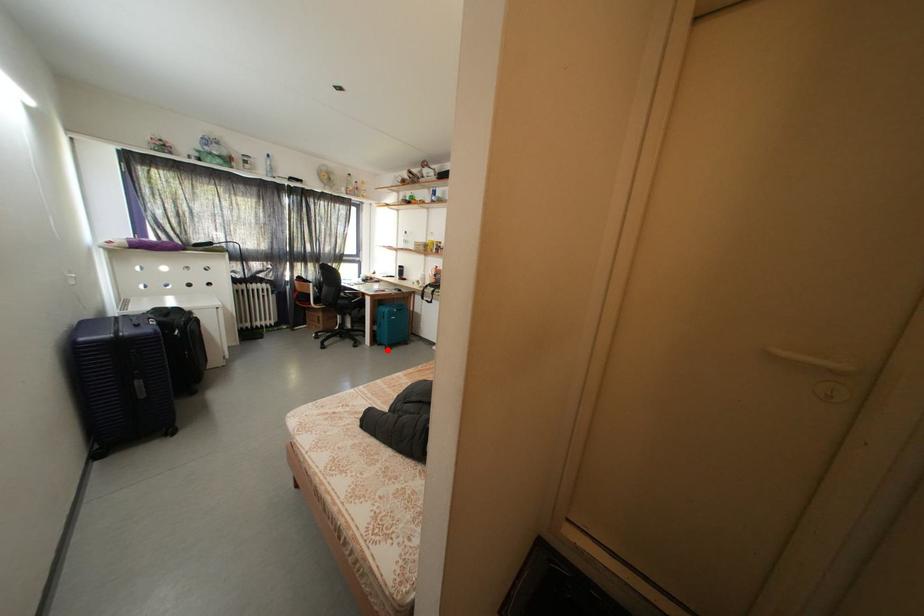
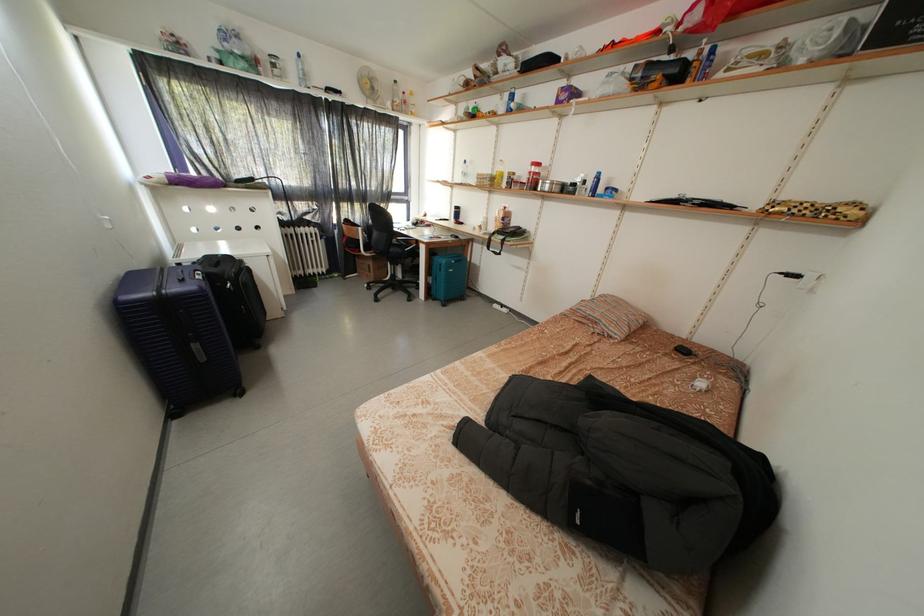
Question: I am providing you with two images of the same scene from different viewpoints. A red point is shown in image1. For the corresponding object point in image2, is it positioned nearer or farther from the camera?

Choices:
 (A) Nearer
 (B) Farther

Answer: (B)